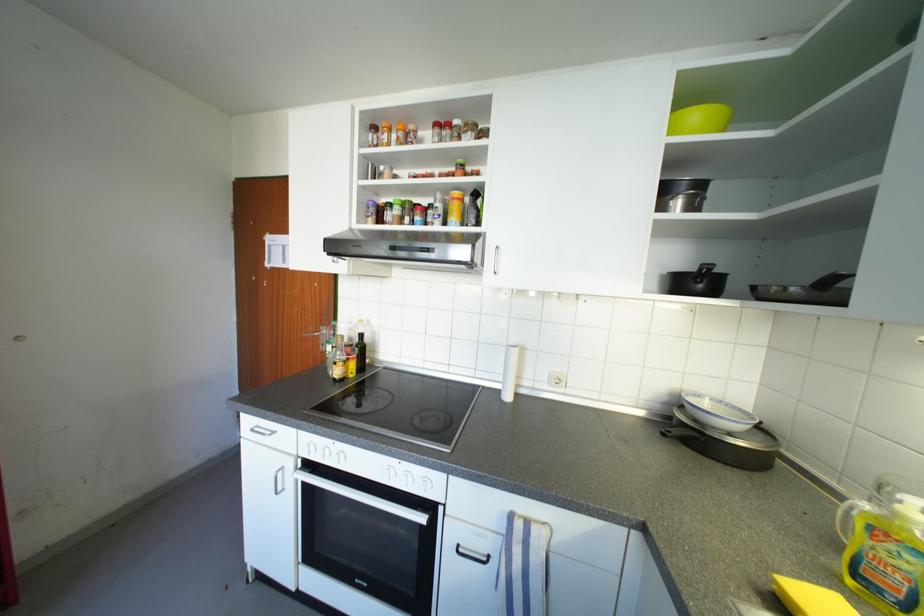
Find the location of a particular element. silver cabinet handle is located at coordinates (277, 480).